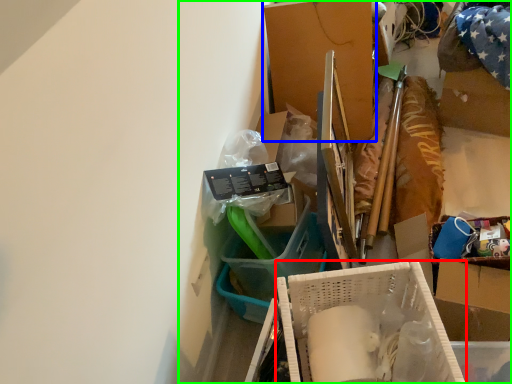
Question: Based on their relative distances, which object is nearer to box (highlighted by a red box)? Choose from box (highlighted by a blue box) and collection (highlighted by a green box).

Choices:
 (A) box
 (B) collection

Answer: (B)